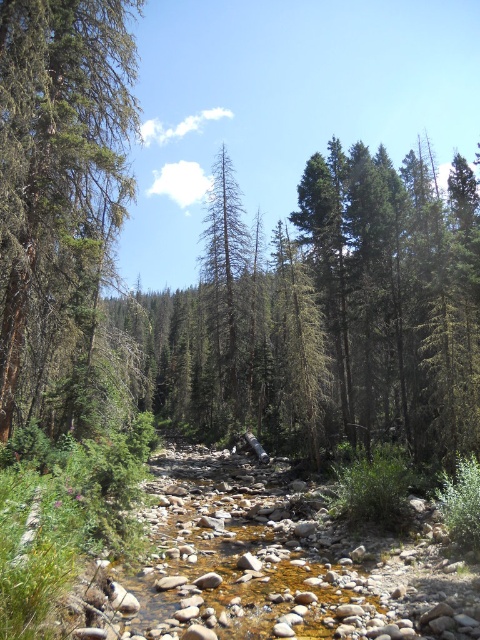
Question: Observing the image, what is the correct spatial positioning of green matte tree at left in reference to gray-brown bark tree at center?

Choices:
 (A) above
 (B) below

Answer: (A)

Question: Which of the following is the farthest from the observer?

Choices:
 (A) (67, 296)
 (B) (239, 401)

Answer: (B)

Question: Is green matte tree at left above gray-brown bark tree at center?

Choices:
 (A) yes
 (B) no

Answer: (A)

Question: Which object is farther from the camera taking this photo?

Choices:
 (A) gray-brown bark tree at center
 (B) green matte tree at left

Answer: (A)

Question: Is green matte tree at left positioned before gray-brown bark tree at center?

Choices:
 (A) yes
 (B) no

Answer: (A)

Question: Among these objects, which one is farthest from the camera?

Choices:
 (A) gray-brown bark tree at center
 (B) green matte tree at left

Answer: (A)